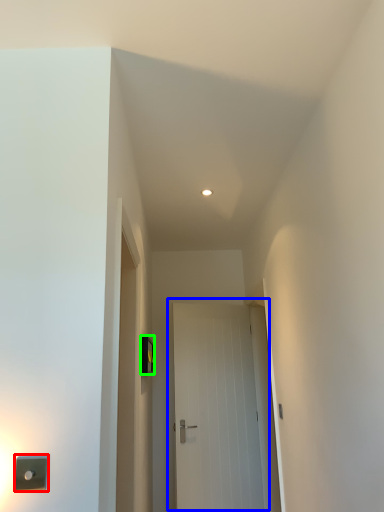
Question: Which is farther away from light switch (highlighted by a red box)? door (highlighted by a blue box) or light switch (highlighted by a green box)?

Choices:
 (A) door
 (B) light switch

Answer: (A)